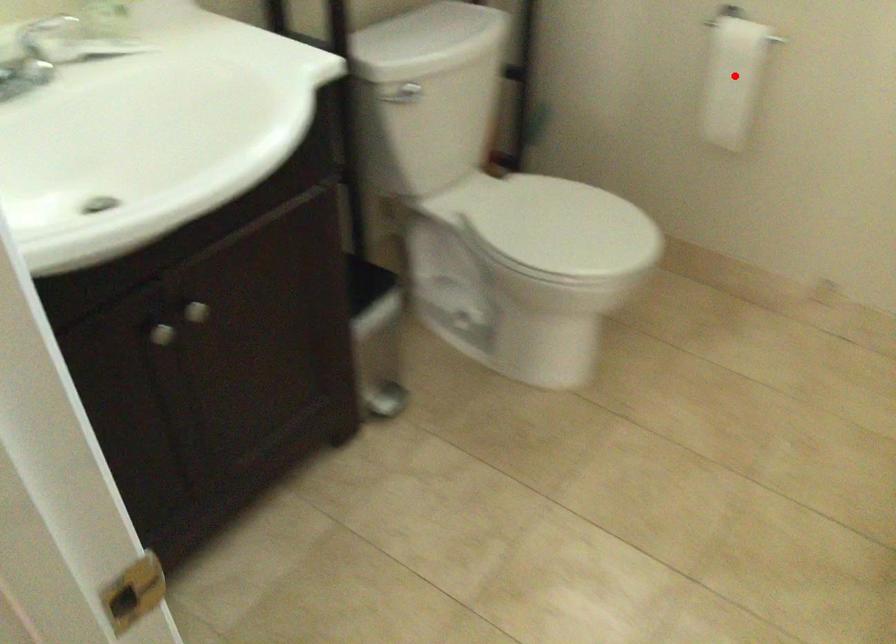
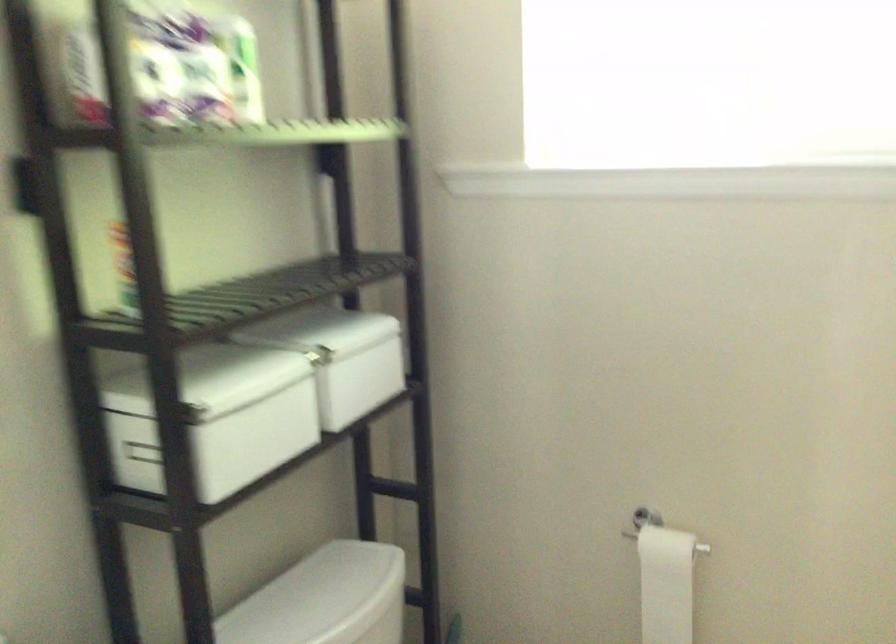
Question: I am providing you with two images of the same scene from different viewpoints. In image1, a red point is highlighted. Considering the same 3D point in image2, which of the following is correct?

Choices:
 (A) It is closer
 (B) It is farther

Answer: (A)